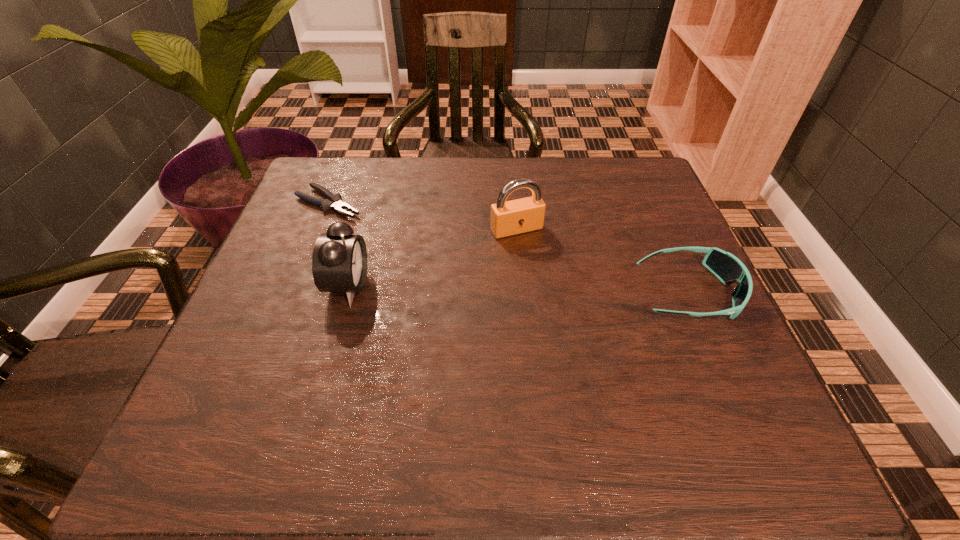
At what (x,y) coordinates should I click in order to perform the action: click on vacant space on the desktop that is between the alarm clock and the rightmost object and is positioned to unlock the third object from left to right from the front. Please return your answer as a coordinate pair (x, y). Looking at the image, I should click on (553, 290).

The height and width of the screenshot is (540, 960). I want to click on vacant spot on the desktop that is between the alarm clock and the rightmost object and is positioned at the gripping part of the pliers, so click(x=497, y=289).